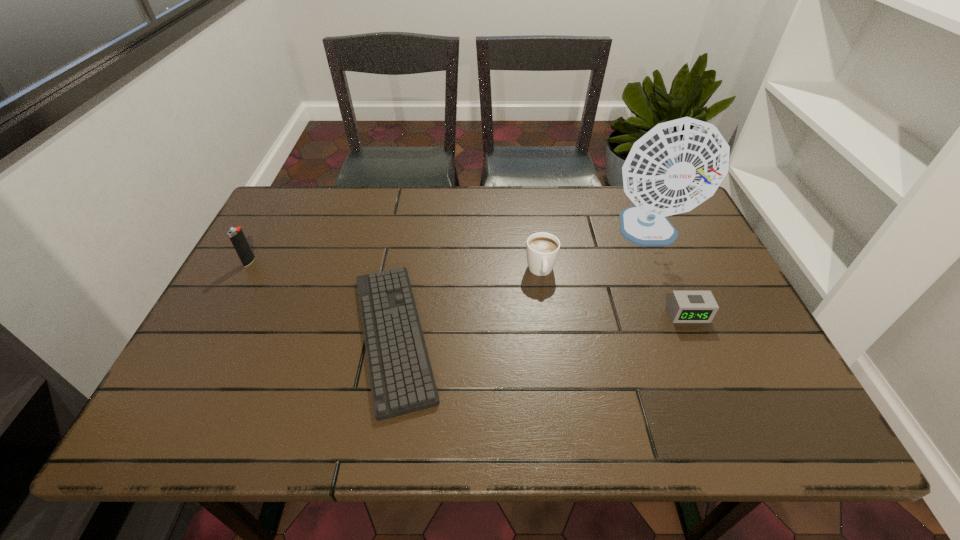
Locate an element on the screen. The width and height of the screenshot is (960, 540). vacant space at the near edge is located at coordinates (340, 434).

In the image, there is a desktop. Where is `vacant space at the left edge`? The width and height of the screenshot is (960, 540). vacant space at the left edge is located at coordinates (241, 278).

Identify the location of vacant space at the right edge. Image resolution: width=960 pixels, height=540 pixels. (745, 327).

The image size is (960, 540). In the image, there is a desktop. Find the location of `free space at the far left corner`. free space at the far left corner is located at coordinates (303, 226).

Find the location of a particular element. Image resolution: width=960 pixels, height=540 pixels. vacant space at the far right corner is located at coordinates (683, 230).

Where is `vacant region between the computer keyboard and the leftmost object`? vacant region between the computer keyboard and the leftmost object is located at coordinates (322, 299).

Locate an element on the screen. The image size is (960, 540). free space between the cappuccino and the tallest object is located at coordinates (595, 252).

You are a GUI agent. You are given a task and a screenshot of the screen. Output one action in this format:
    pyautogui.click(x=<x>, y=<y>)
    Task: Click on the free point between the computer keyboard and the alarm clock
    
    Given the screenshot: What is the action you would take?
    pyautogui.click(x=540, y=325)

Find the location of a particular element. This screenshot has width=960, height=540. vacant area between the shortest object and the third shortest object is located at coordinates (468, 303).

Where is `free point between the third object from right to left and the igniter`? Image resolution: width=960 pixels, height=540 pixels. free point between the third object from right to left and the igniter is located at coordinates (396, 267).